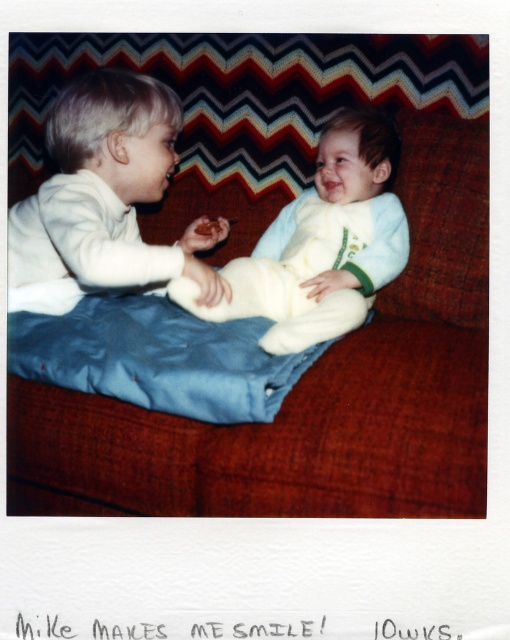
Can you confirm if matte white shirt at left is wider than white fluffy pillow at center?

Yes, matte white shirt at left is wider than white fluffy pillow at center.

Can you confirm if matte white shirt at left is positioned above white fluffy pillow at center?

Actually, matte white shirt at left is below white fluffy pillow at center.

Describe the element at coordinates (104, 198) in the screenshot. I see `matte white shirt at left` at that location.

Locate an element on the screen. The height and width of the screenshot is (640, 510). matte white shirt at left is located at coordinates (104, 198).

Is point (70, 467) less distant than point (479, 141)?

Yes, it is in front of point (479, 141).

Can you confirm if red fabric couch at center is thinner than white fluffy pillow at center?

No.

Does point (399, 116) come farther from viewer compared to point (483, 284)?

Yes, it is behind point (483, 284).

This screenshot has height=640, width=510. What are the coordinates of `red fabric couch at center` in the screenshot? It's located at (312, 392).

Is red fabric couch at center wider than light blue fleece onesie at center?

Yes.

Between point (471, 497) and point (300, 244), which one is positioned in front?

Point (471, 497) is in front.

Find the location of a particular element. Image resolution: width=510 pixels, height=640 pixels. red fabric couch at center is located at coordinates (312, 392).